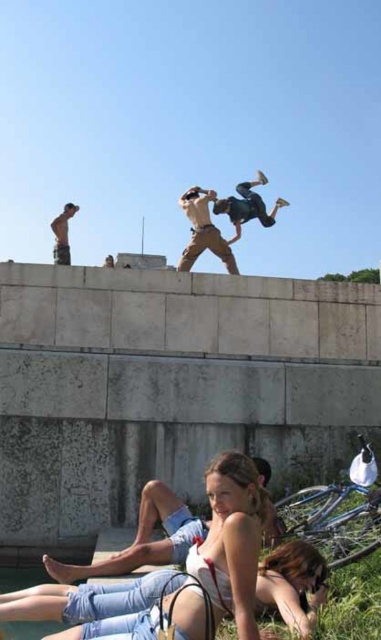
Between point (203, 198) and point (70, 211), which one is positioned in front?

Point (203, 198) is more forward.

Locate an element on the screen. matte khaki pants at center is located at coordinates (203, 230).

Which is in front, point (22, 614) or point (57, 244)?

Point (22, 614) is in front.

Identify the location of denim shorts at lower center. (292, 582).

Who is shorter, denim shorts at lower center or matte khaki pants at center?

With less height is denim shorts at lower center.

Does denim shorts at lower center appear on the left side of matte khaki pants at center?

Correct, you'll find denim shorts at lower center to the left of matte khaki pants at center.

At what (x,y) coordinates should I click in order to perform the action: click on denim shorts at lower center. Please return your answer as a coordinate pair (x, y). This screenshot has width=381, height=640. Looking at the image, I should click on (292, 582).

I want to click on denim shorts at lower center, so click(292, 582).